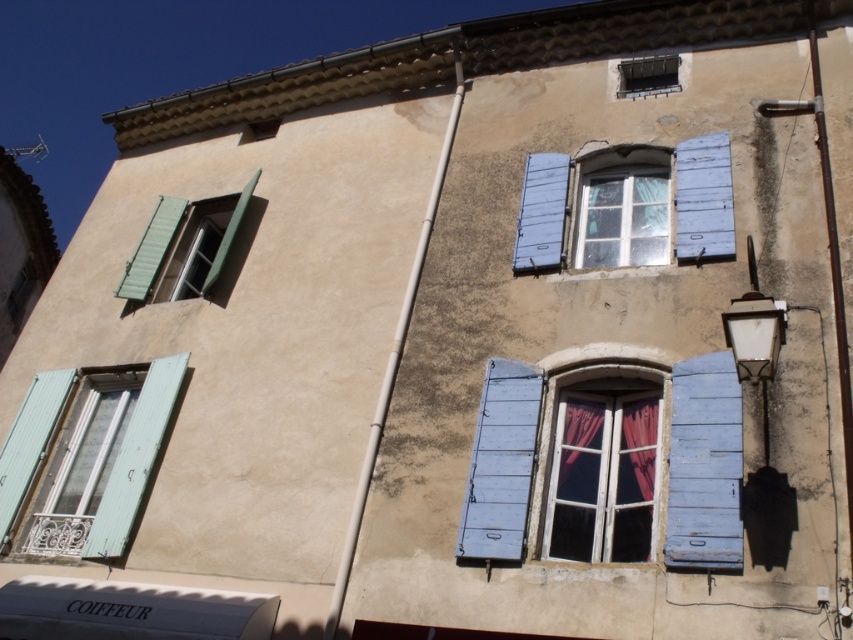
Question: Which point is farther from the camera taking this photo?

Choices:
 (A) (505, 465)
 (B) (717, 355)
 (C) (235, 193)
 (D) (682, 205)

Answer: (C)

Question: Estimate the real-world distances between objects in this image. Which object is farther from the velvet red curtain at center?

Choices:
 (A) matte green shutters at left
 (B) blue painted wood shutter at center right
 (C) white painted wood shutter at upper right
 (D) blue wooden shutters at center

Answer: (A)

Question: Which of the following is the farthest from the observer?

Choices:
 (A) click(566, 179)
 (B) click(213, 272)
 (C) click(151, 272)
 (D) click(489, 445)

Answer: (C)

Question: Does blue painted wood shutter at center right lie behind velvet red curtain at center?

Choices:
 (A) no
 (B) yes

Answer: (A)

Question: Is blue painted wood shutter at center in front of white painted wood shutter at upper right?

Choices:
 (A) yes
 (B) no

Answer: (A)

Question: Does matte teal shutters at lower left appear over blue painted wood shutter at upper center?

Choices:
 (A) no
 (B) yes

Answer: (A)